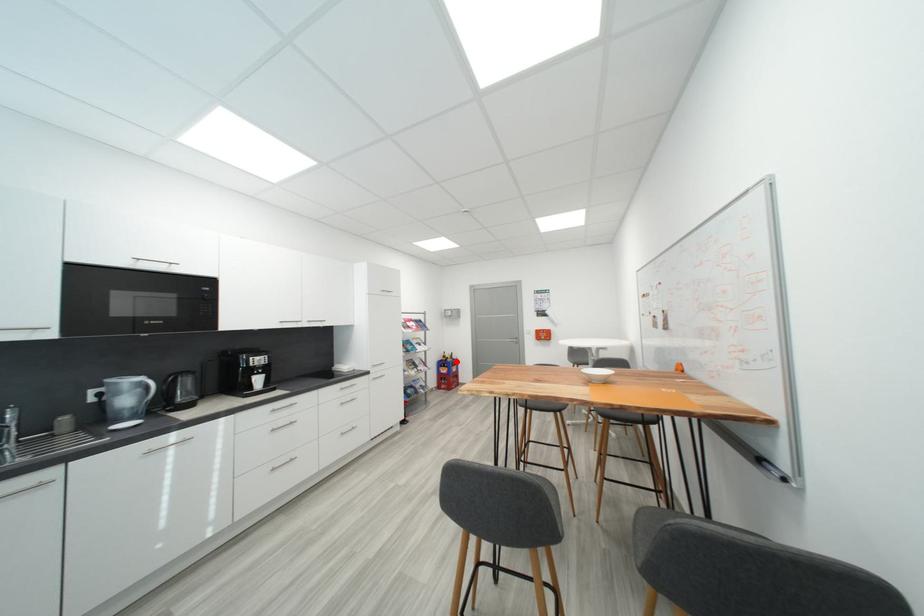
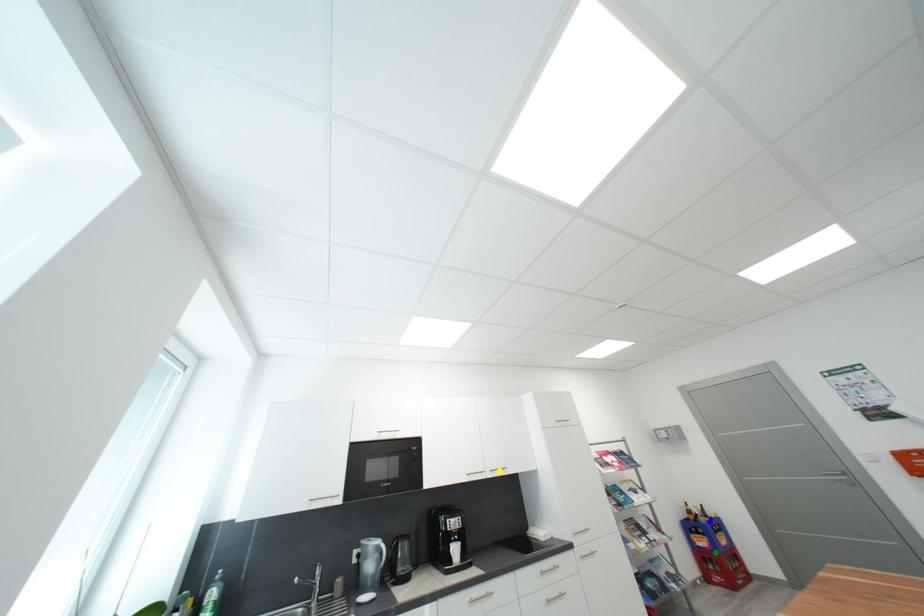
Question: I am providing you with two images of the same scene from different viewpoints. A red point is marked on the first image. You are given multiple points on the second image. Which mark in image 2 goes with the point in image 1?

Choices:
 (A) blue point
 (B) green point
 (C) yellow point

Answer: (A)